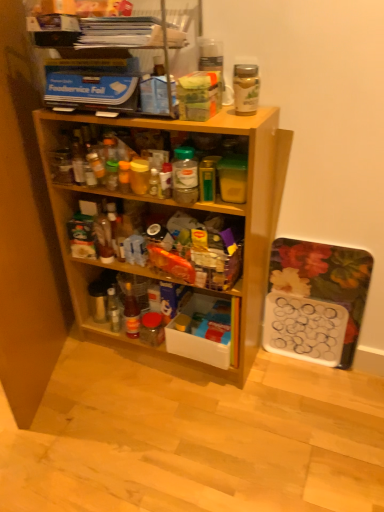
The width and height of the screenshot is (384, 512). I want to click on vacant space situated above wooden shelf at center (from a real-world perspective), so click(x=170, y=113).